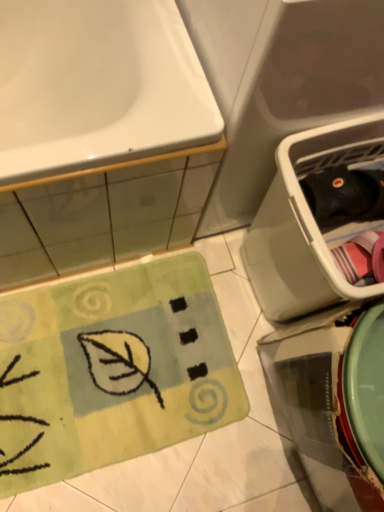
Question: Is white glossy sink at upper left at the left side of black plastic dish washer at right?

Choices:
 (A) no
 (B) yes

Answer: (B)

Question: Considering the relative sizes of white glossy sink at upper left and black plastic dish washer at right in the image provided, is white glossy sink at upper left thinner than black plastic dish washer at right?

Choices:
 (A) no
 (B) yes

Answer: (A)

Question: From a real-world perspective, is white glossy sink at upper left located beneath black plastic dish washer at right?

Choices:
 (A) yes
 (B) no

Answer: (B)

Question: Is black plastic dish washer at right at the back of white glossy sink at upper left?

Choices:
 (A) no
 (B) yes

Answer: (A)

Question: From the image's perspective, is white glossy sink at upper left under black plastic dish washer at right?

Choices:
 (A) yes
 (B) no

Answer: (B)

Question: Is white glossy sink at upper left positioned far away from black plastic dish washer at right?

Choices:
 (A) no
 (B) yes

Answer: (A)

Question: Is white glossy sink at upper left far away from green plush doormat at lower left?

Choices:
 (A) yes
 (B) no

Answer: (B)

Question: From the image's perspective, does white glossy sink at upper left appear lower than green plush doormat at lower left?

Choices:
 (A) no
 (B) yes

Answer: (A)

Question: From a real-world perspective, is white glossy sink at upper left positioned over green plush doormat at lower left based on gravity?

Choices:
 (A) yes
 (B) no

Answer: (A)

Question: Is green plush doormat at lower left surrounded by white glossy sink at upper left?

Choices:
 (A) no
 (B) yes

Answer: (A)

Question: Considering the relative sizes of white glossy sink at upper left and green plush doormat at lower left in the image provided, is white glossy sink at upper left thinner than green plush doormat at lower left?

Choices:
 (A) yes
 (B) no

Answer: (B)

Question: Does white glossy sink at upper left have a greater width compared to green plush doormat at lower left?

Choices:
 (A) yes
 (B) no

Answer: (A)

Question: Could you tell me if green plush doormat at lower left is facing white glossy sink at upper left?

Choices:
 (A) no
 (B) yes

Answer: (A)